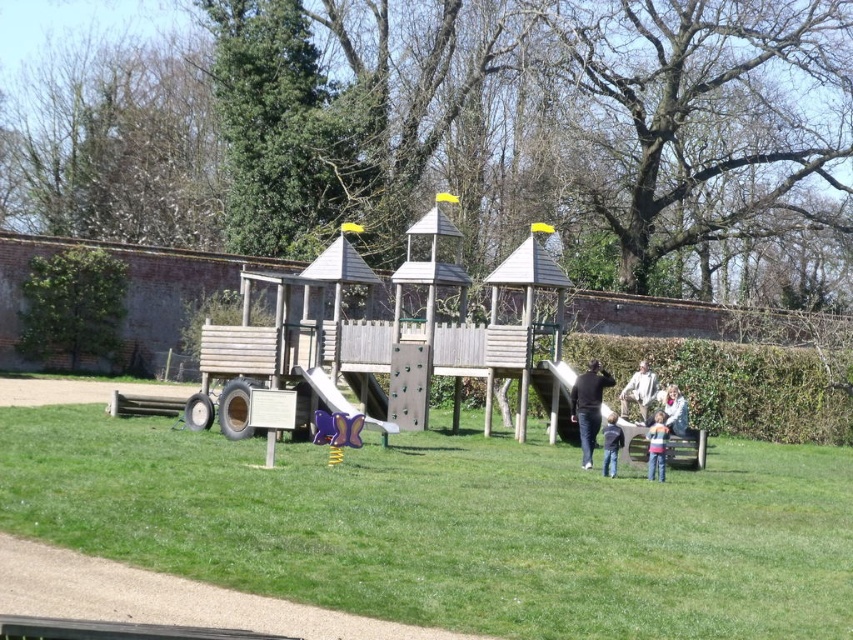
Between white fuzzy jacket at lower right and blue denim jeans at center, which one appears on the left side from the viewer's perspective?

Positioned to the left is blue denim jeans at center.

Is point (675, 410) more distant than point (602, 472)?

Yes, it is.

What do you see at coordinates (674, 410) in the screenshot? The image size is (853, 640). I see `white fuzzy jacket at lower right` at bounding box center [674, 410].

The width and height of the screenshot is (853, 640). Find the location of `white fuzzy jacket at lower right`. white fuzzy jacket at lower right is located at coordinates (674, 410).

Does point (579, 419) come farther from viewer compared to point (618, 456)?

Yes, it is.

Based on the photo, which of these two, black matte jacket at center or blue denim jeans at center, stands taller?

With more height is black matte jacket at center.

The image size is (853, 640). In order to click on black matte jacket at center in this screenshot , I will do point(589,406).

What are the coordinates of `black matte jacket at center` in the screenshot? It's located at (589, 406).

Is black matte jacket at center below white fabric jacket at center?

Incorrect, black matte jacket at center is not positioned below white fabric jacket at center.

Can you confirm if black matte jacket at center is bigger than white fabric jacket at center?

Indeed, black matte jacket at center has a larger size compared to white fabric jacket at center.

Between point (579, 445) and point (643, 420), which one is positioned in front?

Positioned in front is point (643, 420).

Where is `black matte jacket at center`? This screenshot has width=853, height=640. black matte jacket at center is located at coordinates (589, 406).